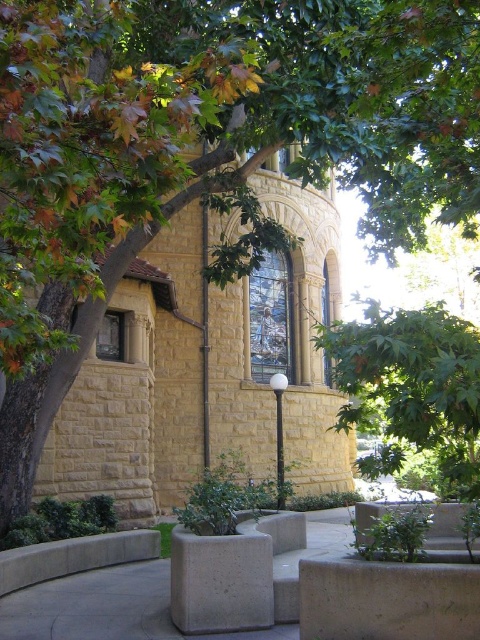
Which is more to the left, green leafy tree at center or gray concrete planter at center?

From the viewer's perspective, gray concrete planter at center appears more on the left side.

Is point (452, 374) behind point (191, 570)?

No.

Is point (375, 340) farther from viewer compared to point (184, 584)?

No.

Locate an element on the screen. The image size is (480, 640). green leafy tree at center is located at coordinates (411, 388).

Identify the location of yellow stone church at center. (202, 369).

Is point (294, 205) less distant than point (469, 353)?

No, (294, 205) is behind (469, 353).

Find the location of a particular element. yellow stone church at center is located at coordinates (202, 369).